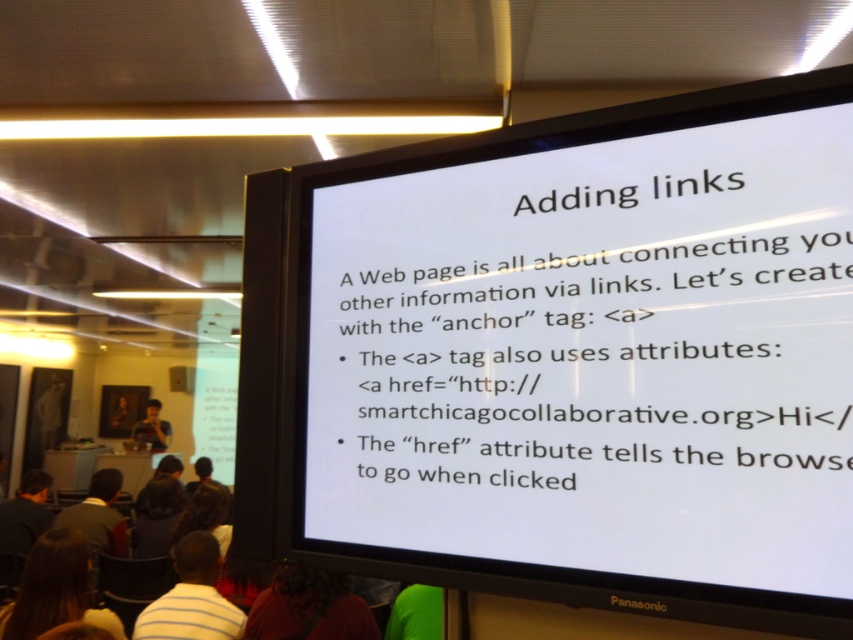
Question: Among these objects, which one is nearest to the camera?

Choices:
 (A) dark brown hair at lower left
 (B) brown hair at lower left
 (C) white paper at upper center

Answer: (C)

Question: Which object appears farthest from the camera in this image?

Choices:
 (A) matte black camera at lower left
 (B) matte brown shirt at lower center

Answer: (A)

Question: Does matte brown shirt at lower center appear on the left side of dark brown hair at lower left?

Choices:
 (A) no
 (B) yes

Answer: (A)

Question: Does white paper at upper center have a larger size compared to brown hair at lower left?

Choices:
 (A) no
 (B) yes

Answer: (B)

Question: Which point is farther to the camera?

Choices:
 (A) matte black camera at lower left
 (B) white striped shirt at lower left
 (C) brown hair at lower left

Answer: (A)

Question: Is matte brown shirt at lower center closer to the viewer compared to white striped shirt at lower left?

Choices:
 (A) no
 (B) yes

Answer: (B)